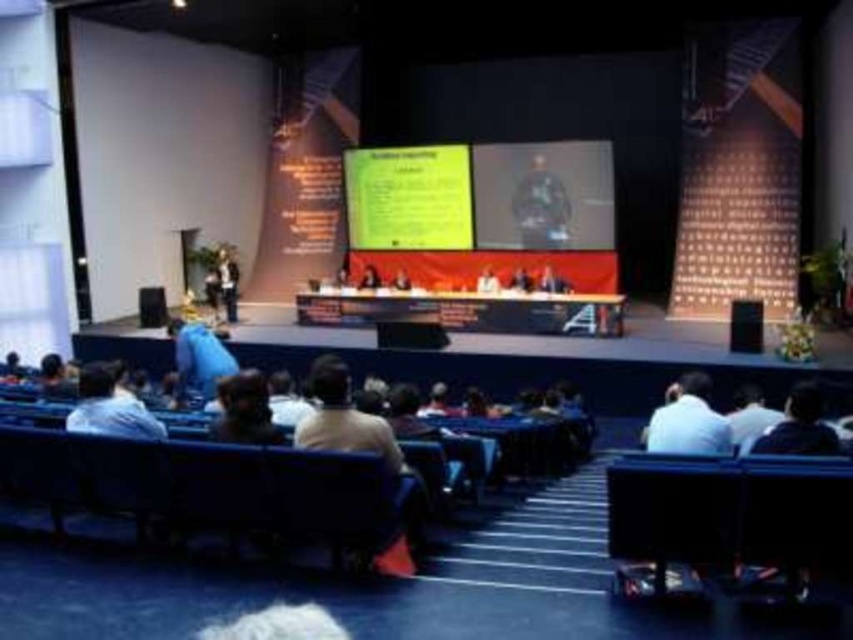
Question: Which point is closer to the camera?

Choices:
 (A) matte black screen at center
 (B) dark brown leather chair at lower right
 (C) yellow paper at upper center

Answer: (B)

Question: Which point is farther to the camera?

Choices:
 (A) light brown leather jacket at center
 (B) dark blue fabric at center
 (C) smooth skin person at center
 (D) smooth skin face at center

Answer: (D)

Question: Is yellow paper at upper center positioned in front of dark brown leather chair at lower right?

Choices:
 (A) yes
 (B) no

Answer: (B)

Question: Based on their relative distances, which object is nearer to the smooth skin face at center?

Choices:
 (A) dark blue fabric at center
 (B) dark brown leather chair at lower right

Answer: (A)

Question: Does smooth skin face at center have a smaller size compared to smooth skin person at center?

Choices:
 (A) no
 (B) yes

Answer: (A)

Question: Can you confirm if dark blue fabric at center is positioned to the left of dark brown leather chair at lower right?

Choices:
 (A) yes
 (B) no

Answer: (A)